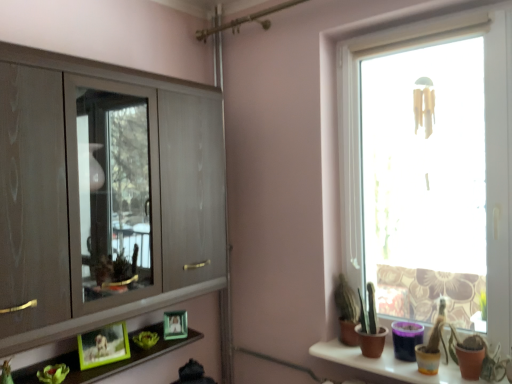
Question: Considering the relative sizes of green matte picture frame at lower left, which is counted as the 1th picture frame, starting from the left, and transparent glass window at right in the image provided, is green matte picture frame at lower left, which is counted as the 1th picture frame, starting from the left, wider than transparent glass window at right?

Choices:
 (A) no
 (B) yes

Answer: (A)

Question: From a real-world perspective, is green matte picture frame at lower left, which is counted as the 1th picture frame, starting from the left, physically above transparent glass window at right?

Choices:
 (A) yes
 (B) no

Answer: (B)

Question: Is green matte picture frame at lower left, which is counted as the 1th picture frame, starting from the left, not close to transparent glass window at right?

Choices:
 (A) no
 (B) yes

Answer: (B)

Question: Does green matte picture frame at lower left, the 2th picture frame positioned from the right, have a lesser width compared to transparent glass window at right?

Choices:
 (A) yes
 (B) no

Answer: (A)

Question: From the image's perspective, would you say green matte picture frame at lower left, the second picture frame positioned from the back, is shown under transparent glass window at right?

Choices:
 (A) yes
 (B) no

Answer: (A)

Question: From the image's perspective, is green matte picture frame at lower left, the 2th picture frame positioned from the right, on top of transparent glass window at right?

Choices:
 (A) yes
 (B) no

Answer: (B)

Question: Is the depth of transparent glass window at right greater than that of green matte picture frame at lower left, which is counted as the 1th picture frame, starting from the left?

Choices:
 (A) no
 (B) yes

Answer: (A)

Question: Can you confirm if transparent glass window at right is thinner than green matte picture frame at lower left, the 2th picture frame positioned from the right?

Choices:
 (A) yes
 (B) no

Answer: (B)

Question: From a real-world perspective, is transparent glass window at right located higher than green matte picture frame at lower left, which appears as the 1th picture frame when viewed from the front?

Choices:
 (A) no
 (B) yes

Answer: (B)

Question: Can you confirm if transparent glass window at right is taller than green matte picture frame at lower left, which is counted as the 1th picture frame, starting from the left?

Choices:
 (A) no
 (B) yes

Answer: (B)

Question: Is green matte picture frame at lower left, which appears as the 1th picture frame when viewed from the front, at the back of transparent glass window at right?

Choices:
 (A) no
 (B) yes

Answer: (A)

Question: Is transparent glass window at right closer to the viewer compared to green matte picture frame at lower left, the 2th picture frame positioned from the right?

Choices:
 (A) no
 (B) yes

Answer: (B)

Question: From the image's perspective, is matte wood cupboard at left over green matte plant at lower left?

Choices:
 (A) yes
 (B) no

Answer: (A)